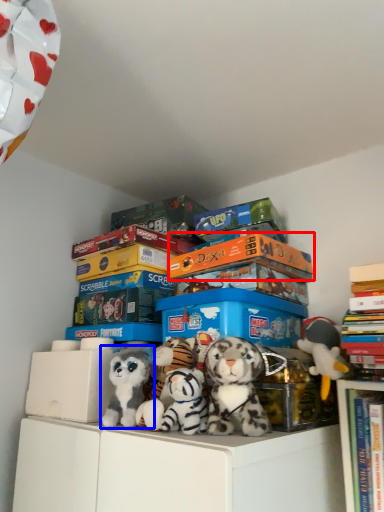
Question: Which of the following is the closest to the observer, book (highlighted by a red box) or toy (highlighted by a blue box)?

Choices:
 (A) book
 (B) toy

Answer: (B)